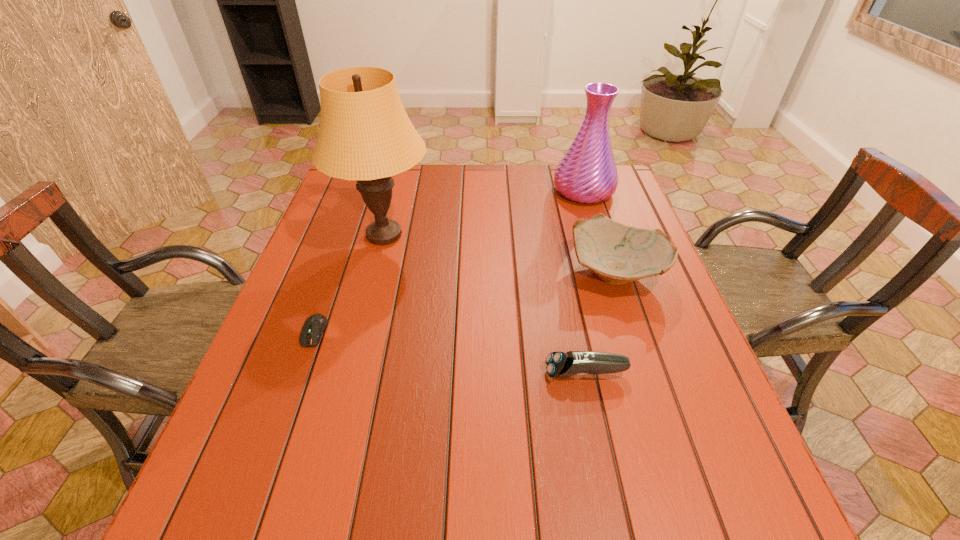
Where is `free spot located on the head of the nearest object`? The height and width of the screenshot is (540, 960). free spot located on the head of the nearest object is located at coordinates pos(361,373).

Find the location of `free space located on the head of the nearest object`. free space located on the head of the nearest object is located at coordinates (416, 373).

You are a GUI agent. You are given a task and a screenshot of the screen. Output one action in this format:
    pyautogui.click(x=<x>, y=<y>)
    Task: Click on the vacant space located on the head of the nearest object
    
    Given the screenshot: What is the action you would take?
    pyautogui.click(x=480, y=373)

This screenshot has height=540, width=960. Find the location of `free location located 0.060m on the button of the computer equipment`. free location located 0.060m on the button of the computer equipment is located at coordinates (300, 372).

This screenshot has width=960, height=540. I want to click on object situated at the far edge, so click(x=587, y=173).

Image resolution: width=960 pixels, height=540 pixels. In order to click on lampshade at the left edge in this screenshot , I will do `click(365, 134)`.

The height and width of the screenshot is (540, 960). What are the coordinates of `computer equipment located in the left edge section of the desktop` in the screenshot? It's located at coord(314,326).

In order to click on vase located at the right edge in this screenshot , I will do `click(587, 173)`.

Locate an element on the screen. The height and width of the screenshot is (540, 960). pottery that is at the right edge is located at coordinates (617, 253).

Locate an element on the screen. The width and height of the screenshot is (960, 540). electric shaver that is at the right edge is located at coordinates (559, 364).